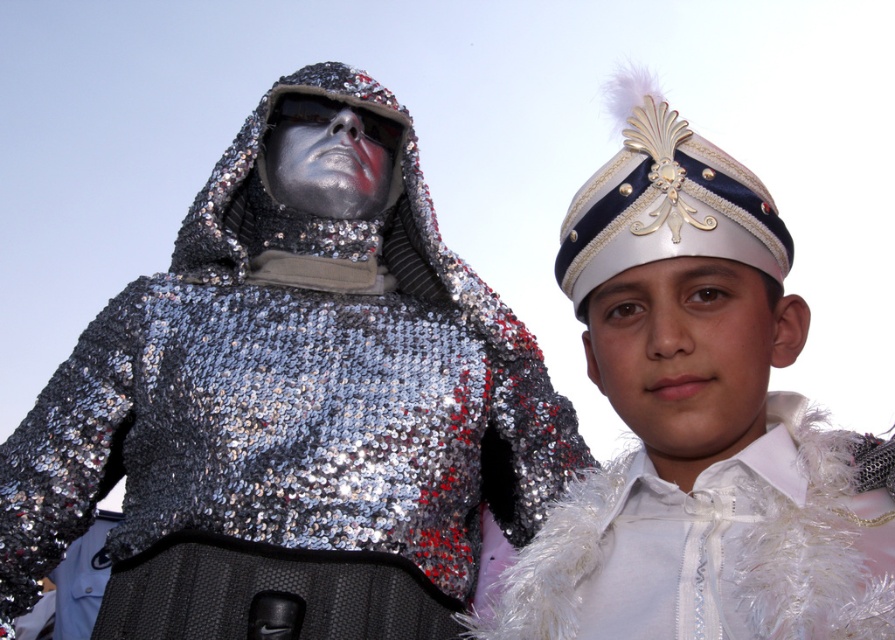
You are a photographer trying to capture the best angle of the two performers. You notice the white feathered hat at upper right and the white satin headdress at upper right. Which one is closer to the camera?

The white feathered hat at upper right is in front of the white satin headdress at upper right, so it is closer to the camera.

You are a photographer at the event and need to capture both the white feathered hat at upper right and the white satin headdress at upper right in a single frame. Which of the two requires more horizontal space in the camera frame?

The white feathered hat at upper right requires more horizontal space in the camera frame because its width is larger than the white satin headdress at upper right.

You are standing at a point 34.16 meters away from the scene. You want to take a photo of the two individuals in the parade. If you position yourself at point (x=368, y=390), will you be able to capture both individuals in the frame?

The point (x=368, y=390) is 34.16 meters away from the viewer. Since both individuals are part of the same scene and the distance is consistent, positioning yourself at this point will allow you to capture both individuals in the frame as they are within the same visual range.